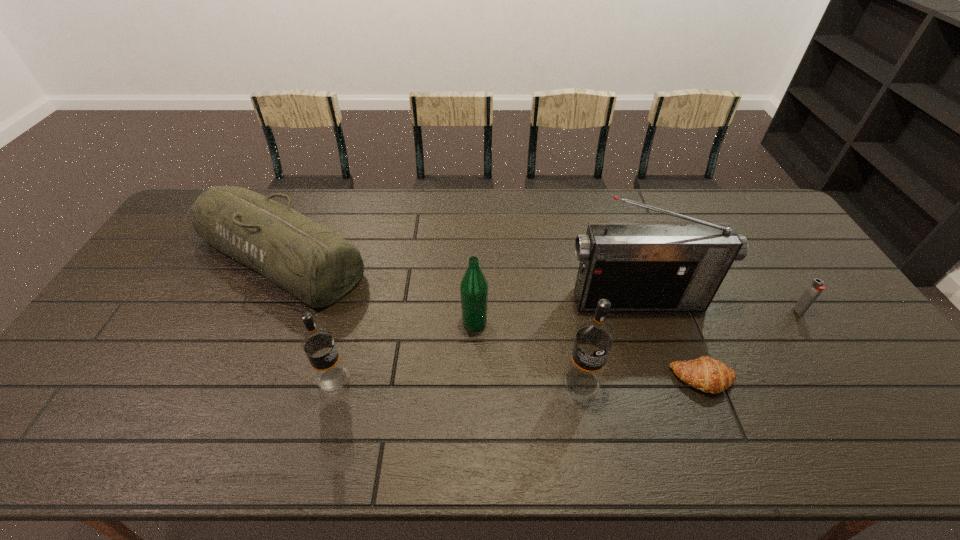
The width and height of the screenshot is (960, 540). Identify the location of the left vodka. (317, 342).

What are the coordinates of `the taller vodka` in the screenshot? It's located at (595, 335).

Identify the location of the sixth shortest object. The height and width of the screenshot is (540, 960). (595, 335).

Locate an element on the screen. Image resolution: width=960 pixels, height=540 pixels. radio receiver is located at coordinates (637, 265).

Identify the location of the fifth tallest object. pyautogui.click(x=311, y=262).

This screenshot has height=540, width=960. I want to click on the third object from left to right, so click(x=473, y=288).

Find the location of a particular element. The width and height of the screenshot is (960, 540). the sixth tallest object is located at coordinates (816, 287).

You are a GUI agent. You are given a task and a screenshot of the screen. Output one action in this format:
    pyautogui.click(x=<x>, y=<y>)
    Task: Click on the igniter
    The height and width of the screenshot is (540, 960).
    Given the screenshot: What is the action you would take?
    pyautogui.click(x=816, y=287)

Locate an element on the screen. The width and height of the screenshot is (960, 540). crescent roll is located at coordinates (710, 375).

Locate an element on the screen. This screenshot has height=540, width=960. vacant point located on the label of the shorter vodka is located at coordinates (501, 379).